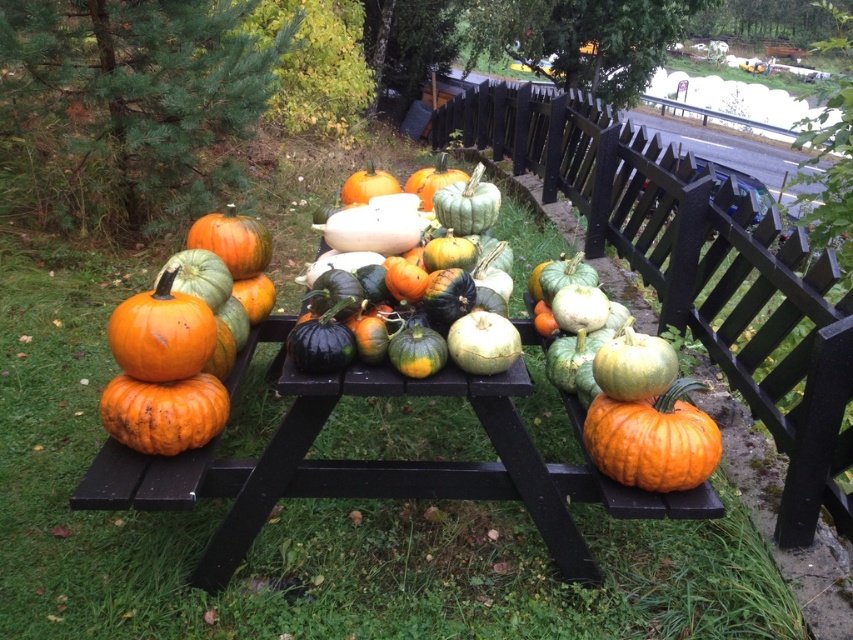
Question: Is black wood fence at center below orange matte pumpkin at lower left?

Choices:
 (A) no
 (B) yes

Answer: (A)

Question: Estimate the real-world distances between objects in this image. Which object is closer to the orange matte pumpkin at lower left?

Choices:
 (A) black wood fence at center
 (B) orange matte pumpkin at center
 (C) green matte gourds at center

Answer: (C)

Question: Estimate the real-world distances between objects in this image. Which object is closer to the green matte gourds at center?

Choices:
 (A) orange matte pumpkin at lower left
 (B) orange matte pumpkin at center

Answer: (A)

Question: Is black wood fence at center below orange matte pumpkin at lower left?

Choices:
 (A) yes
 (B) no

Answer: (B)

Question: Which object appears closest to the camera in this image?

Choices:
 (A) orange matte pumpkin at center
 (B) green matte gourds at center
 (C) orange matte pumpkin at lower left

Answer: (A)

Question: Where is green matte gourds at center located in relation to orange matte pumpkin at center in the image?

Choices:
 (A) left
 (B) right

Answer: (A)